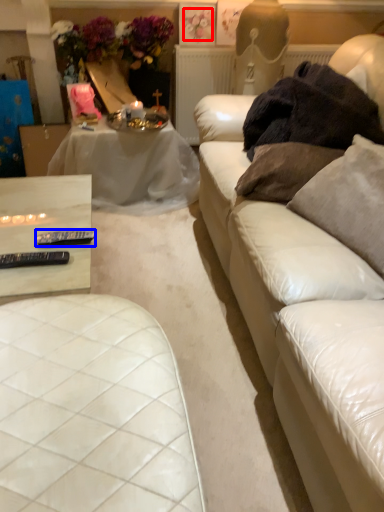
Question: Which object appears closest to the camera in this image, flower (highlighted by a red box) or tableware (highlighted by a blue box)?

Choices:
 (A) flower
 (B) tableware

Answer: (B)